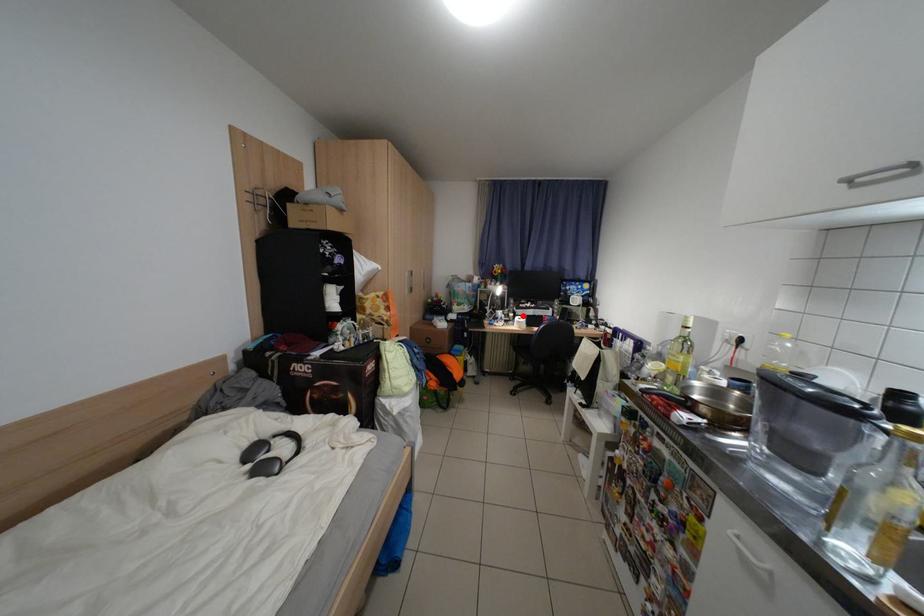
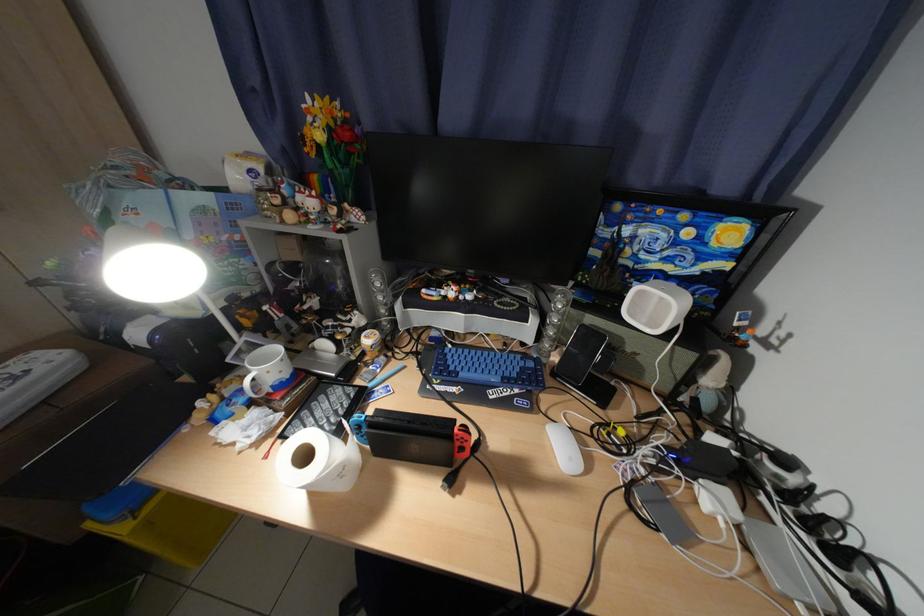
Where in the second image is the point corresponding to the highlighted location from the first image?

(381, 341)